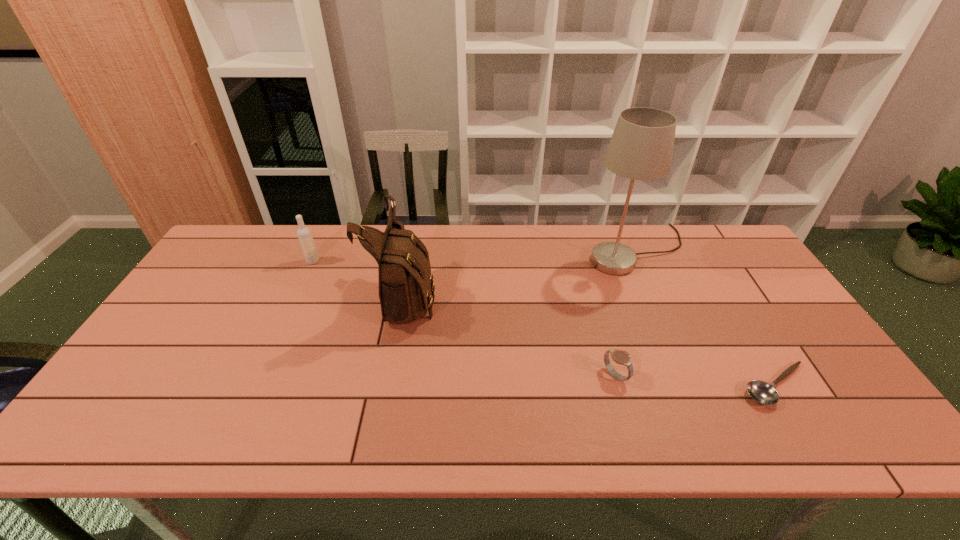
Locate an element on the screen. This screenshot has width=960, height=540. the tallest object is located at coordinates (641, 148).

Locate an element on the screen. The image size is (960, 540). the second object from left to right is located at coordinates (406, 284).

Locate an element on the screen. shoulder bag is located at coordinates (406, 284).

Find the location of a particular element. Image resolution: width=960 pixels, height=540 pixels. vodka is located at coordinates (304, 234).

At what (x,y) coordinates should I click in order to perform the action: click on the third shortest object. Please return your answer as a coordinate pair (x, y). Looking at the image, I should click on (304, 234).

Locate an element on the screen. This screenshot has width=960, height=540. the fourth tallest object is located at coordinates (620, 357).

Identify the location of ladle. (762, 392).

You are a GUI agent. You are given a task and a screenshot of the screen. Output one action in this format:
    pyautogui.click(x=<x>, y=<y>)
    Task: Click on the vacant position located on the front of the table lamp
    The height and width of the screenshot is (540, 960).
    Given the screenshot: What is the action you would take?
    pyautogui.click(x=657, y=300)

Locate an element on the screen. vacant space located 0.130m on the front-facing side of the shoulder bag is located at coordinates (480, 295).

Locate an element on the screen. The height and width of the screenshot is (540, 960). free space located on the front of the vodka is located at coordinates (290, 312).